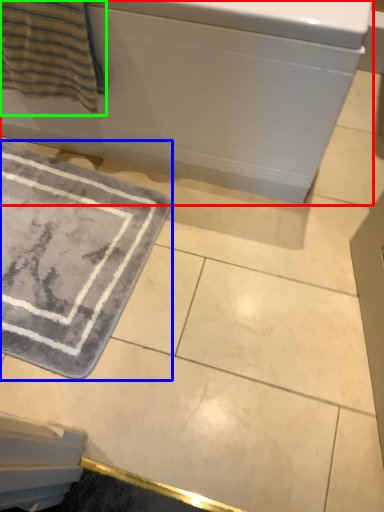
Question: Considering the real-world distances, which object is closest to bath (highlighted by a red box)? bath mat (highlighted by a blue box) or beach towel (highlighted by a green box).

Choices:
 (A) bath mat
 (B) beach towel

Answer: (B)